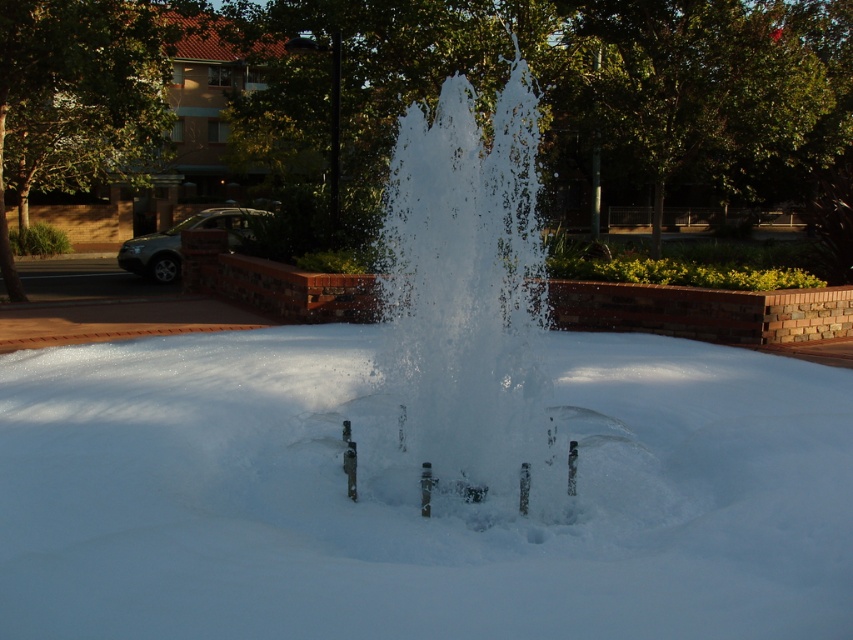
You are a photographer planning to capture the white frosty snow at center and the clear water fountain at center in a single frame. Given that your camera can only focus on objects within a 5 meter width, will both objects fit within the frame?

The white frosty snow at center has a width less than the clear water fountain at center. Since the camera can focus on objects within a 5 meter width, both objects will fit within the frame as their combined width is likely under 5 meters.

Consider the image. You are standing at the edge of the park and want to take a photo of the clear water fountain at center without the white frosty snow at center blocking the view. Is it possible to do so from your current position?

The white frosty snow at center is in front of the clear water fountain at center, so it is blocking the view. To take a photo of the clear water fountain at center without the snow blocking the view, you would need to move to a position where the snow is not in front of the fountain, such as behind the snow or adjusting your angle so that the snow is not between you and the fountain.

You are standing in the park and want to walk from the fountain to the residential building with red tiles. Which point, point (x=325, y=467) or point (x=454, y=344), is closer to your starting position at the fountain?

Point (x=325, y=467) is closer to the fountain because it is further to the viewer than point (x=454, y=344).